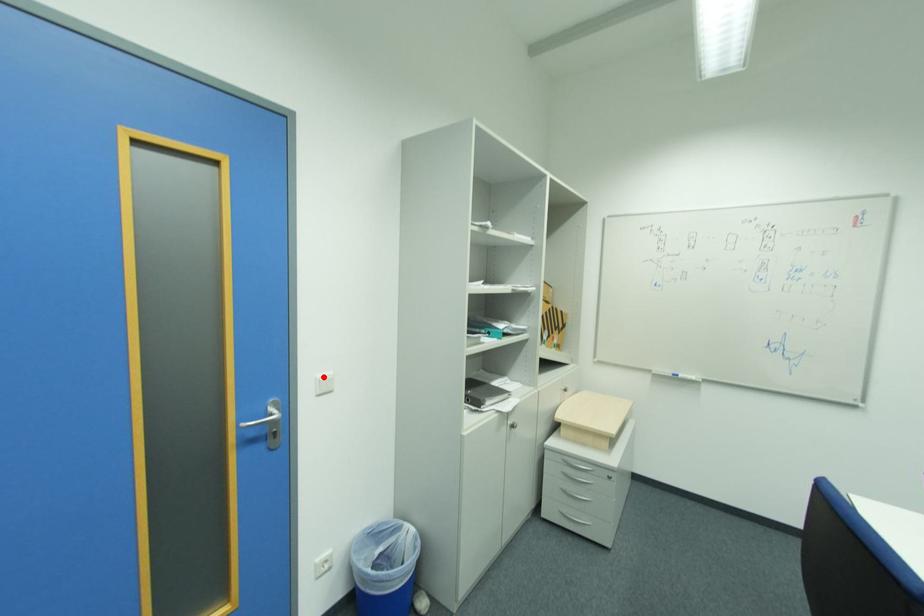
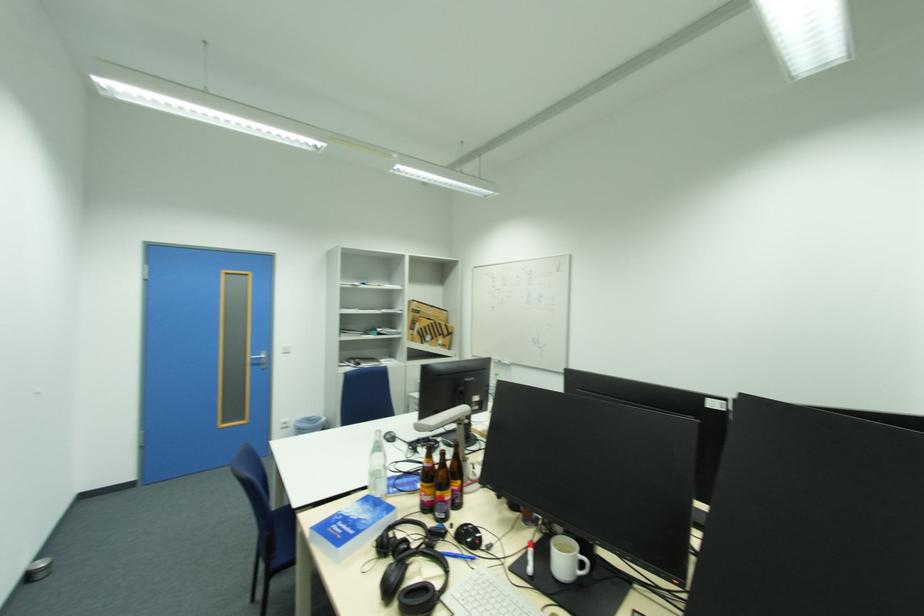
Where in the second image is the point corresponding to the highlighted location from the first image?

(289, 347)